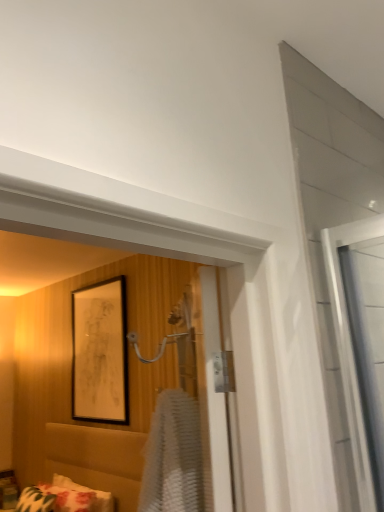
At what (x,y) coordinates should I click in order to perform the action: click on white textured bath towel at center. Please return your answer as a coordinate pair (x, y). The height and width of the screenshot is (512, 384). Looking at the image, I should click on (173, 457).

Image resolution: width=384 pixels, height=512 pixels. Describe the element at coordinates (173, 457) in the screenshot. I see `white textured bath towel at center` at that location.

Find the location of `white textured bath towel at center`. white textured bath towel at center is located at coordinates (173, 457).